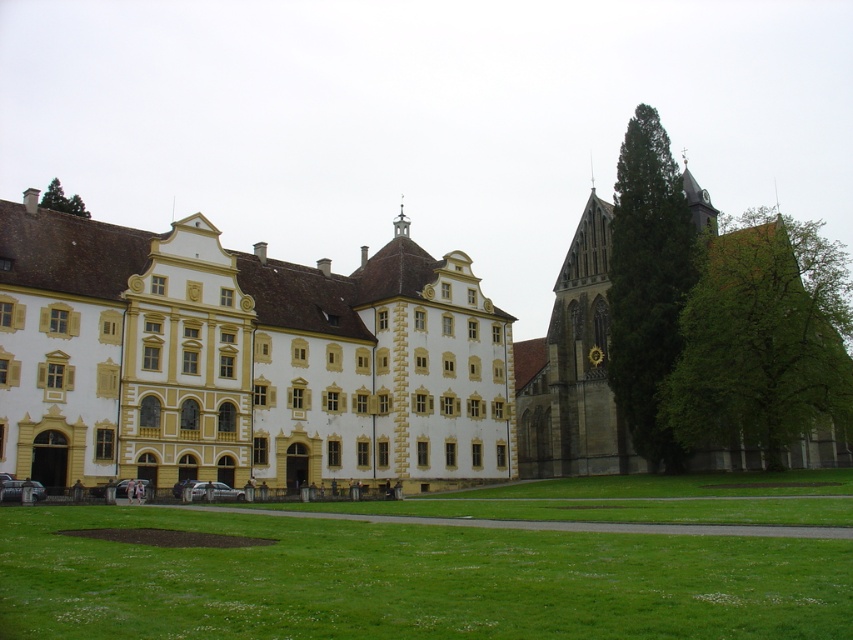
You are standing in front of the main building and want to take a photo of the yellow stone church at center and the green leafy tree at right. Which object will appear closer to you in the photo?

The yellow stone church at center will appear closer to you in the photo because it is positioned in front of the green leafy tree at right.

Based on the photo, you are a landscape architect designing a garden path between the green grass at lower center and the green textured tree at right. Which area requires more space to accommodate the path?

The green grass at lower center requires more space because its width is larger than the green textured tree at right.